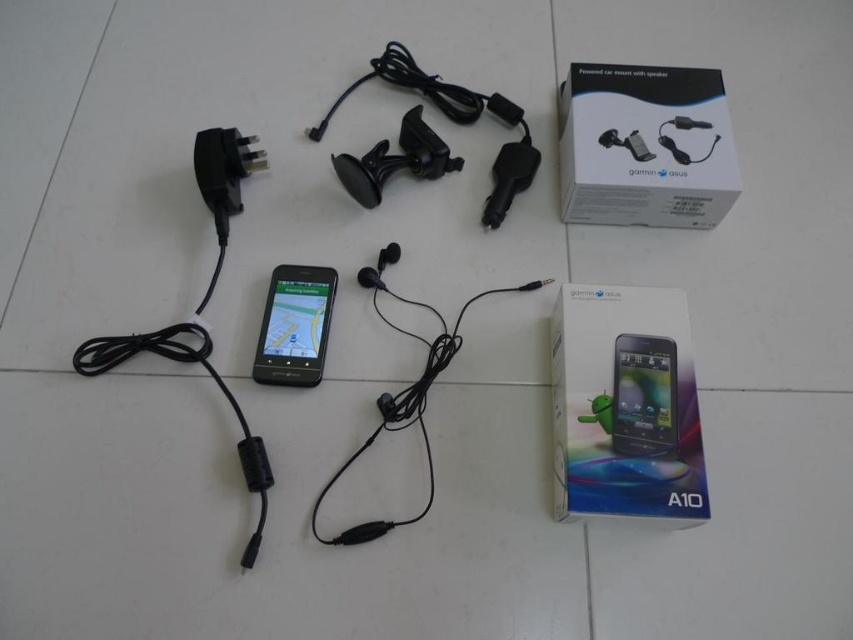
Question: Does metallic blue smartphone box at center come behind black glossy phone at center?

Choices:
 (A) no
 (B) yes

Answer: (A)

Question: Estimate the real-world distances between objects in this image. Which object is closer to the white matte box at upper right?

Choices:
 (A) metallic blue smartphone box at center
 (B) black glossy phone at center
 (C) matte black phone at center

Answer: (A)

Question: Does white matte box at upper right appear on the right side of black glossy phone at center?

Choices:
 (A) yes
 (B) no

Answer: (A)

Question: Can you confirm if white matte box at upper right is wider than black glossy phone at center?

Choices:
 (A) yes
 (B) no

Answer: (A)

Question: Which of these objects is positioned closest to the matte black phone at center?

Choices:
 (A) metallic blue smartphone box at center
 (B) white matte box at upper right

Answer: (A)

Question: Estimate the real-world distances between objects in this image. Which object is farther from the matte black phone at center?

Choices:
 (A) black glossy phone at center
 (B) white matte box at upper right
 (C) metallic blue smartphone box at center

Answer: (A)